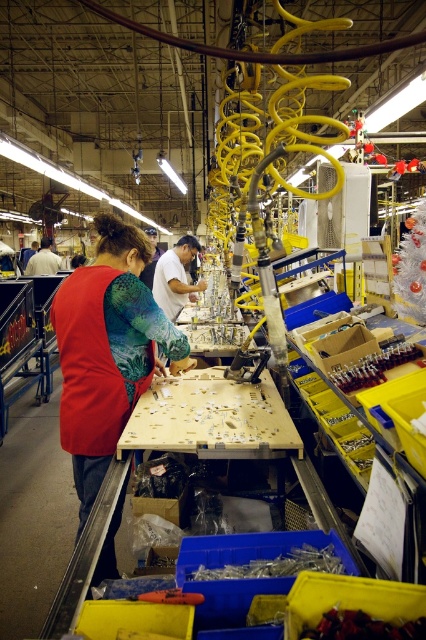
Question: Does red fabric vest at center have a larger size compared to metallic silver screwdriver at lower right?

Choices:
 (A) no
 (B) yes

Answer: (B)

Question: Among these objects, which one is farthest from the camera?

Choices:
 (A) red fabric vest at center
 (B) red fabric shirt at center
 (C) metallic silver screwdriver at lower right

Answer: (B)

Question: Which is nearer to the red fabric shirt at center?

Choices:
 (A) metallic silver screwdriver at lower right
 (B) red fabric vest at center
 (C) metallic blue screwdriver at lower center

Answer: (B)

Question: Which of the following is the closest to the observer?

Choices:
 (A) red fabric shirt at center
 (B) metallic silver screwdriver at lower right
 (C) red fabric vest at center
 (D) metallic blue screwdriver at lower center

Answer: (D)

Question: Is red fabric vest at center positioned behind metallic blue screwdriver at lower center?

Choices:
 (A) yes
 (B) no

Answer: (A)

Question: Is red fabric vest at center below metallic blue screwdriver at lower center?

Choices:
 (A) no
 (B) yes

Answer: (A)